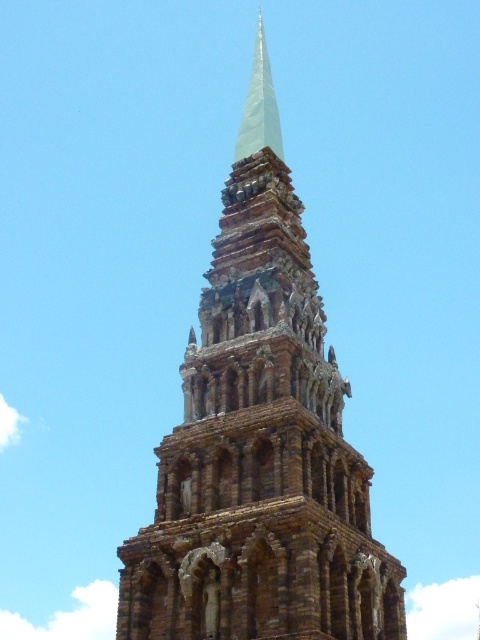
Question: Is brown stone tower at center positioned at the back of white glass spire at center?

Choices:
 (A) yes
 (B) no

Answer: (B)

Question: Among these objects, which one is farthest from the camera?

Choices:
 (A) brown stone tower at center
 (B) white glass spire at center

Answer: (B)

Question: Is brown stone tower at center to the left of white glass spire at center from the viewer's perspective?

Choices:
 (A) yes
 (B) no

Answer: (B)

Question: Does brown stone tower at center appear over white glass spire at center?

Choices:
 (A) yes
 (B) no

Answer: (B)

Question: Among these points, which one is farthest from the camera?

Choices:
 (A) (254, 58)
 (B) (235, 628)

Answer: (A)